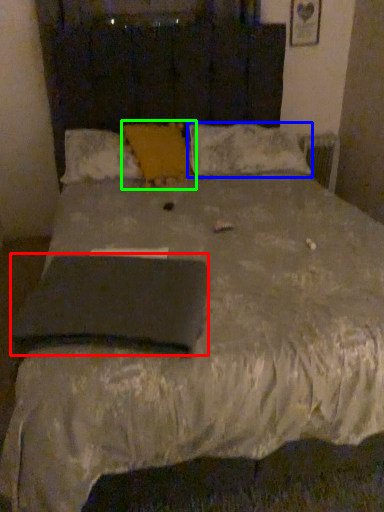
Question: Which object is the farthest from pad (highlighted by a red box)? Choose among these: pillow (highlighted by a blue box) or pillow (highlighted by a green box).

Choices:
 (A) pillow
 (B) pillow

Answer: (A)